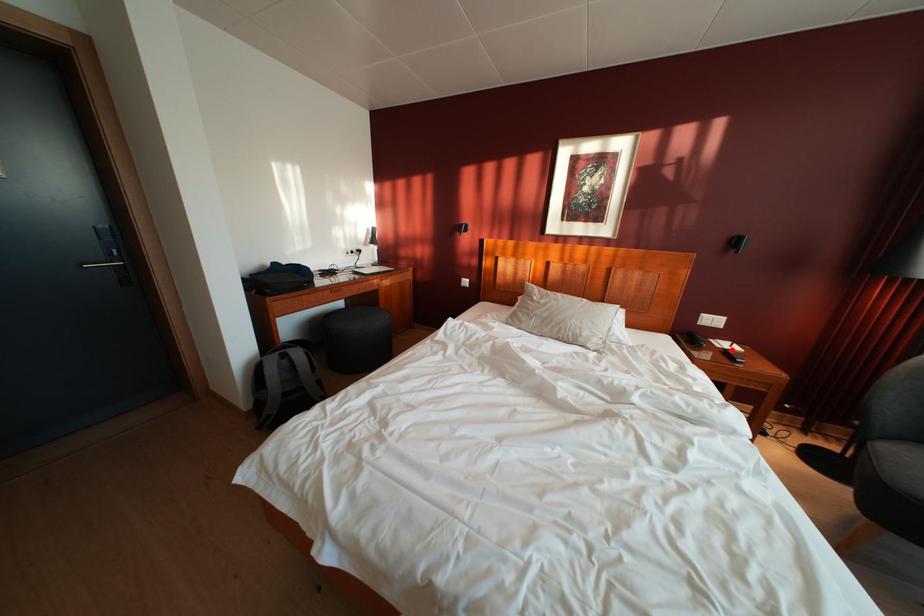
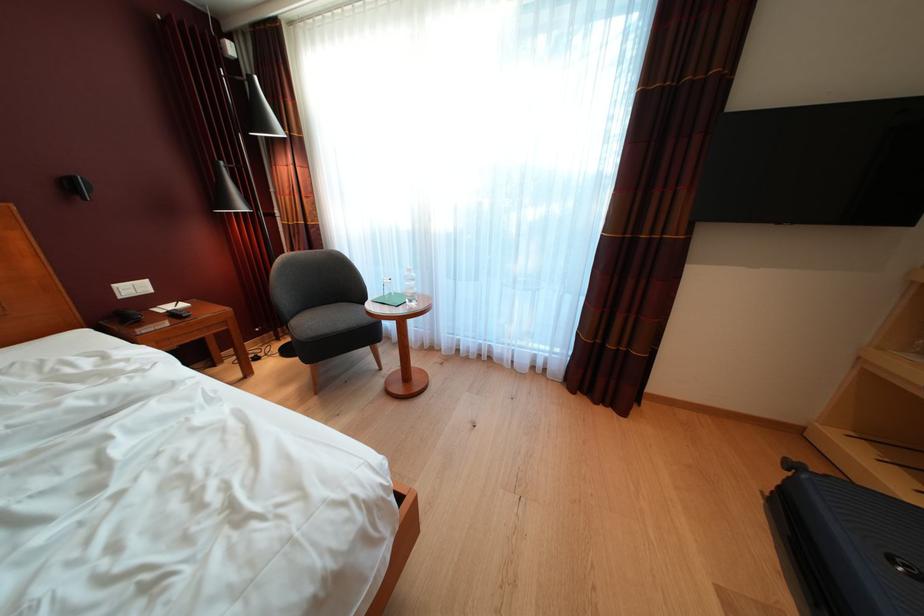
Where in the second image is the point corresponding to the highlighted location from the first image?

(176, 314)